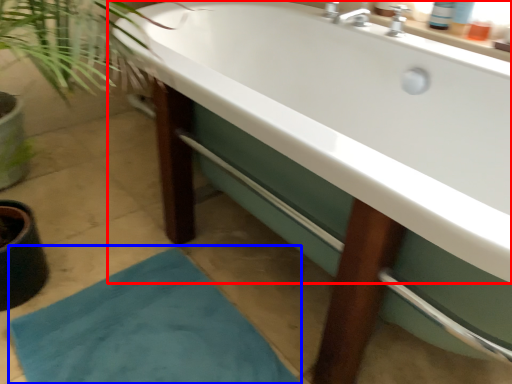
Question: Which point is closer to the camera, bathtub (highlighted by a red box) or bath mat (highlighted by a blue box)?

Choices:
 (A) bathtub
 (B) bath mat

Answer: (A)